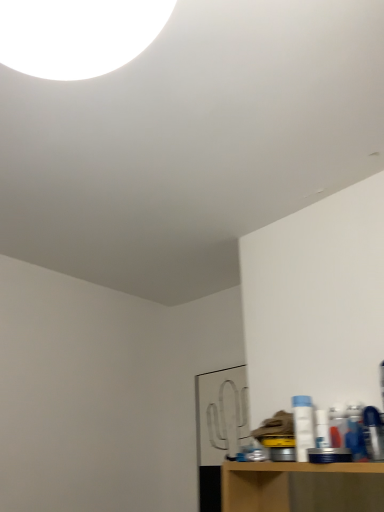
Question: Considering the positions of point (x=291, y=396) and point (x=112, y=38), is point (x=291, y=396) closer or farther from the camera than point (x=112, y=38)?

Choices:
 (A) closer
 (B) farther

Answer: (B)

Question: Considering the positions of white plastic bottle at right and white glossy light at upper center in the image, is white plastic bottle at right bigger or smaller than white glossy light at upper center?

Choices:
 (A) big
 (B) small

Answer: (B)

Question: From the image's perspective, is white plastic bottle at right above or below white glossy light at upper center?

Choices:
 (A) above
 (B) below

Answer: (B)

Question: Is white glossy light at upper center taller or shorter than white plastic bottle at right?

Choices:
 (A) tall
 (B) short

Answer: (A)

Question: From a real-world perspective, is white glossy light at upper center above or below white plastic bottle at right?

Choices:
 (A) above
 (B) below

Answer: (A)

Question: In the image, is white glossy light at upper center on the left side or the right side of white plastic bottle at right?

Choices:
 (A) right
 (B) left

Answer: (B)

Question: Considering their positions, is white glossy light at upper center located in front of or behind white plastic bottle at right?

Choices:
 (A) front
 (B) behind

Answer: (A)